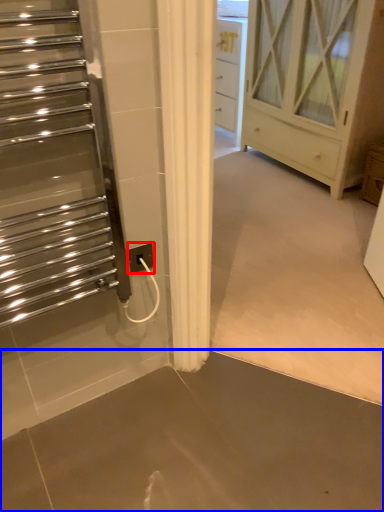
Question: Which point is further to the camera, electric outlet (highlighted by a red box) or concrete (highlighted by a blue box)?

Choices:
 (A) electric outlet
 (B) concrete

Answer: (A)